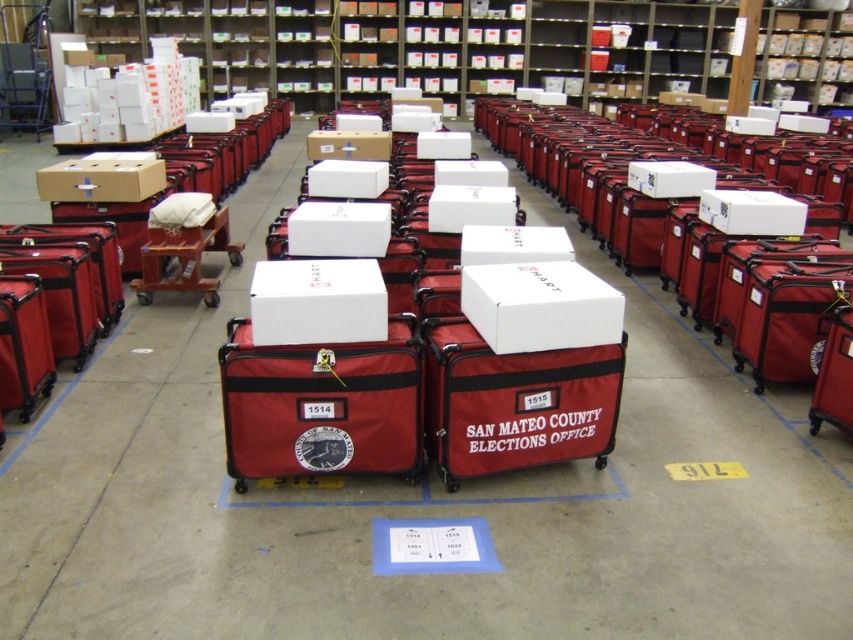
Who is positioned more to the right, white matte box at center or matte cardboard box at upper left?

white matte box at center

Where is `white matte box at center`? white matte box at center is located at coordinates (317, 301).

Can you confirm if matte cardboard box at upper left is taller than matte cardboard box at center?

Yes, matte cardboard box at upper left is taller than matte cardboard box at center.

Which is more to the right, matte cardboard box at upper left or matte cardboard box at center?

From the viewer's perspective, matte cardboard box at center appears more on the right side.

Who is more distant from viewer, (136, 179) or (326, 141)?

The point (326, 141) is more distant.

Where is `matte cardboard box at upper left`? matte cardboard box at upper left is located at coordinates (102, 177).

Does matte red luggage at center have a lesser width compared to red fabric rolling bag at center?

Incorrect, matte red luggage at center's width is not less than red fabric rolling bag at center's.

Who is positioned more to the left, matte red luggage at center or red fabric rolling bag at center?

red fabric rolling bag at center is more to the left.

At what (x,y) coordinates should I click in order to perform the action: click on matte red luggage at center. Please return your answer as a coordinate pair (x, y). Image resolution: width=853 pixels, height=640 pixels. Looking at the image, I should click on (505, 392).